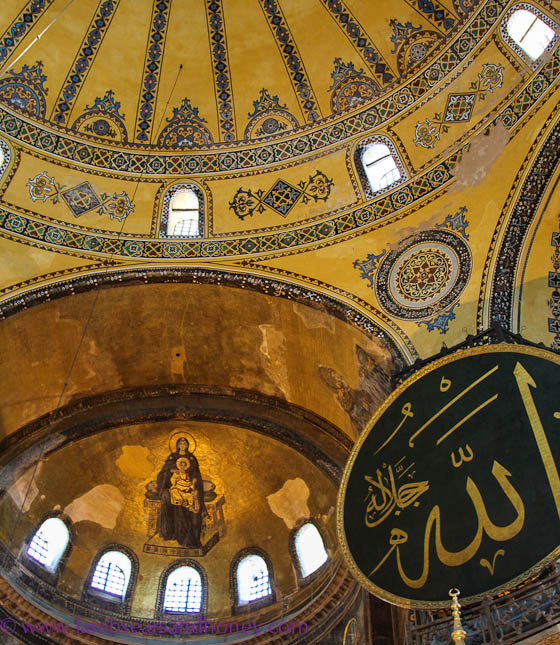
This screenshot has width=560, height=645. What are the coordinates of `ceiling` in the screenshot? It's located at (226, 59).